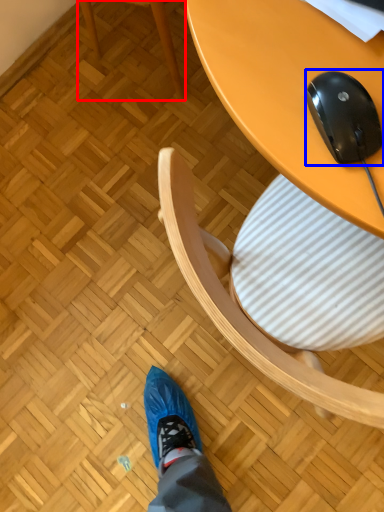
Question: Which of the following is the farthest to the observer, chair (highlighted by a red box) or mouse (highlighted by a blue box)?

Choices:
 (A) chair
 (B) mouse

Answer: (A)